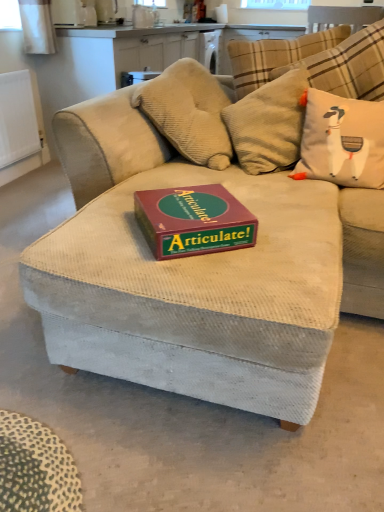
Question: Considering the relative sizes of white matte radiator at left and white fabric pillow with cartoon llama at upper right in the image provided, is white matte radiator at left thinner than white fabric pillow with cartoon llama at upper right?

Choices:
 (A) yes
 (B) no

Answer: (A)

Question: Is white matte radiator at left aimed at white fabric pillow with cartoon llama at upper right?

Choices:
 (A) no
 (B) yes

Answer: (B)

Question: Is white matte radiator at left positioned with its back to white fabric pillow with cartoon llama at upper right?

Choices:
 (A) yes
 (B) no

Answer: (B)

Question: Is white matte radiator at left positioned beyond the bounds of white fabric pillow with cartoon llama at upper right?

Choices:
 (A) no
 (B) yes

Answer: (B)

Question: Is white matte radiator at left bigger than white fabric pillow with cartoon llama at upper right?

Choices:
 (A) yes
 (B) no

Answer: (B)

Question: Would you say white fabric pillow with cartoon llama at upper right is to the left or to the right of maroon cardboard articulate! game box on the center in the picture?

Choices:
 (A) right
 (B) left

Answer: (A)

Question: From the image's perspective, is white fabric pillow with cartoon llama at upper right above or below maroon cardboard articulate! game box on the center?

Choices:
 (A) below
 (B) above

Answer: (B)

Question: Based on their sizes in the image, would you say white fabric pillow with cartoon llama at upper right is bigger or smaller than maroon cardboard articulate! game box on the center?

Choices:
 (A) big
 (B) small

Answer: (A)

Question: Is white fabric pillow with cartoon llama at upper right inside or outside of maroon cardboard articulate! game box on the center?

Choices:
 (A) outside
 (B) inside

Answer: (A)

Question: Would you say white matte radiator at left is inside or outside white fabric pillow with cartoon llama at upper right?

Choices:
 (A) inside
 (B) outside

Answer: (B)

Question: Is white matte radiator at left in front of or behind white fabric pillow with cartoon llama at upper right in the image?

Choices:
 (A) front
 (B) behind

Answer: (B)

Question: Based on their positions, is white matte radiator at left located to the left or right of white fabric pillow with cartoon llama at upper right?

Choices:
 (A) left
 (B) right

Answer: (A)

Question: Is white matte radiator at left wider or thinner than white fabric pillow with cartoon llama at upper right?

Choices:
 (A) wide
 (B) thin

Answer: (B)

Question: Considering the positions of white matte radiator at left and maroon cardboard articulate! game box on the center in the image, is white matte radiator at left taller or shorter than maroon cardboard articulate! game box on the center?

Choices:
 (A) tall
 (B) short

Answer: (A)

Question: Looking at the image, does white matte radiator at left seem bigger or smaller compared to maroon cardboard articulate! game box on the center?

Choices:
 (A) small
 (B) big

Answer: (B)